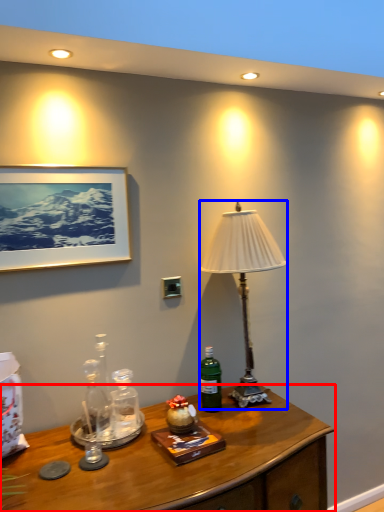
Question: Which of the following is the closest to the observer, desk (highlighted by a red box) or lamp (highlighted by a blue box)?

Choices:
 (A) desk
 (B) lamp

Answer: (A)